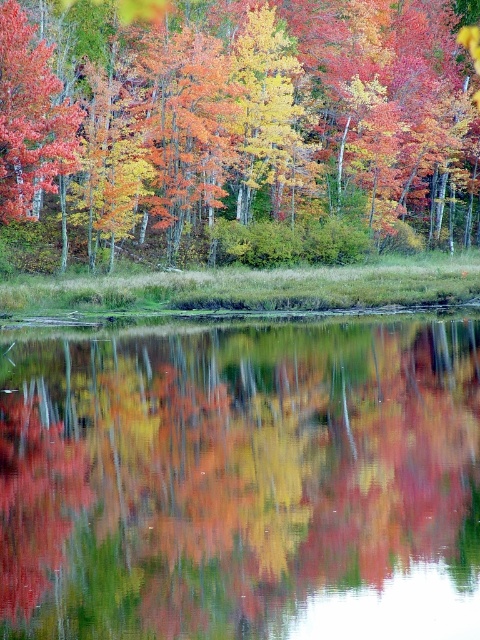
Question: Is transparent glass water at center in front of autumn leaves at center?

Choices:
 (A) yes
 (B) no

Answer: (A)

Question: Which point is closer to the camera taking this photo?

Choices:
 (A) (466, 580)
 (B) (191, 116)

Answer: (A)

Question: From the image, what is the correct spatial relationship of transparent glass water at center in relation to autumn leaves at center?

Choices:
 (A) right
 (B) left

Answer: (B)

Question: Is transparent glass water at center positioned behind autumn leaves at center?

Choices:
 (A) no
 (B) yes

Answer: (A)

Question: Among these points, which one is nearest to the camera?

Choices:
 (A) (220, 445)
 (B) (409, 134)

Answer: (A)